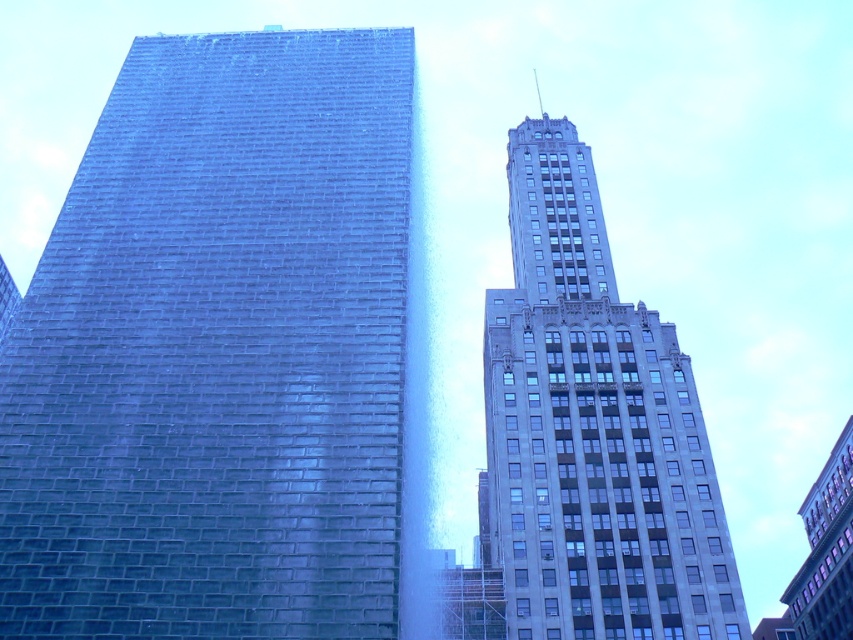
You are standing in the middle of the image and looking towards the smooth glass tower at left. Which direction should you turn to face the point marked at coordinates point (218,352)?

The point marked at coordinates point (218,352) is located on the smooth glass tower at left. Since you are standing in the middle of the image and facing the smooth glass tower at left, you are already facing the direction of the point. Therefore, you don not need to turn. You can remain facing forward to face the point marked at coordinates point (218,352).

You are standing in the middle of the city square and see the smooth glass tower at left and the gray stone tower at upper right. Which building is closer to you?

The smooth glass tower at left is closer to you because it is in front of the gray stone tower at upper right.

You are an architect analyzing the spatial relationship between the smooth glass tower at left and the gray stone tower at upper right. Which tower is positioned higher in the image?

The smooth glass tower at left is positioned higher than the gray stone tower at upper right according to the description.